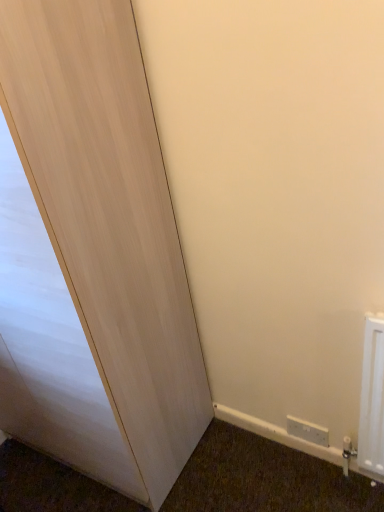
Describe the element at coordinates (308, 431) in the screenshot. I see `white plastic electric outlet at lower right` at that location.

At what (x,y) coordinates should I click in order to perform the action: click on white plastic electric outlet at lower right. Please return your answer as a coordinate pair (x, y). This screenshot has width=384, height=512. Looking at the image, I should click on (308, 431).

In order to face white plastic electric outlet at lower right, should I rotate leftwards or rightwards?

Rotate right and turn 15.168 degrees.

Measure the distance between white plastic electric outlet at lower right and camera.

The depth of white plastic electric outlet at lower right is 4.72 feet.

I want to click on light wood door at left, so click(x=91, y=255).

This screenshot has height=512, width=384. Describe the element at coordinates (91, 255) in the screenshot. I see `light wood door at left` at that location.

Where is `white plastic electric outlet at lower right`? white plastic electric outlet at lower right is located at coordinates (308, 431).

Which object is positioned more to the left, white plastic electric outlet at lower right or light wood door at left?

Positioned to the left is light wood door at left.

Which is in front, white plastic electric outlet at lower right or light wood door at left?

Positioned in front is light wood door at left.

Is point (326, 432) closer or farther from the camera than point (54, 250)?

Point (326, 432).

From the image's perspective, is white plastic electric outlet at lower right located above or below light wood door at left?

Based on their image positions, white plastic electric outlet at lower right is located beneath light wood door at left.

From a real-world perspective, who is located higher, white plastic electric outlet at lower right or light wood door at left?

In real-world perspective, light wood door at left is above.

Which object is thinner, white plastic electric outlet at lower right or light wood door at left?

With smaller width is white plastic electric outlet at lower right.

Who is taller, white plastic electric outlet at lower right or light wood door at left?

Standing taller between the two is light wood door at left.

Who is bigger, white plastic electric outlet at lower right or light wood door at left?

With larger size is light wood door at left.

Is white plastic electric outlet at lower right situated inside light wood door at left or outside?

white plastic electric outlet at lower right is not inside light wood door at left, it's outside.

Is white plastic electric outlet at lower right not close to light wood door at left?

No, white plastic electric outlet at lower right is not far away from light wood door at left.

From the picture: Could you tell me if white plastic electric outlet at lower right is turned towards light wood door at left?

No, white plastic electric outlet at lower right is not facing towards light wood door at left.

How many degrees apart are the facing directions of white plastic electric outlet at lower right and light wood door at left?

They differ by 1.87 degrees in their facing directions.

Identify the location of electric outlet on the right of light wood door at left. (308, 431).

Which is more to the left, light wood door at left or white plastic electric outlet at lower right?

Positioned to the left is light wood door at left.

Is light wood door at left further to the viewer compared to white plastic electric outlet at lower right?

No, light wood door at left is closer to the viewer.

In the scene shown: Which is closer, (x=158, y=284) or (x=302, y=435)?

Clearly, point (x=158, y=284) is closer to the camera than point (x=302, y=435).

From the image's perspective, would you say light wood door at left is positioned over white plastic electric outlet at lower right?

Yes, from the image's perspective, light wood door at left is above white plastic electric outlet at lower right.

From a real-world perspective, is light wood door at left under white plastic electric outlet at lower right?

No, from a real-world perspective, light wood door at left is not beneath white plastic electric outlet at lower right.

Between light wood door at left and white plastic electric outlet at lower right, which one has smaller width?

white plastic electric outlet at lower right.

In terms of height, does light wood door at left look taller or shorter compared to white plastic electric outlet at lower right?

In the image, light wood door at left appears to be taller than white plastic electric outlet at lower right.

Does light wood door at left have a larger size compared to white plastic electric outlet at lower right?

Yes, light wood door at left is bigger than white plastic electric outlet at lower right.

Consider the image. Would you say light wood door at left is outside white plastic electric outlet at lower right?

light wood door at left is positioned outside white plastic electric outlet at lower right.

Are light wood door at left and white plastic electric outlet at lower right beside each other?

They are not placed beside each other.

Could you tell me if light wood door at left is turned towards white plastic electric outlet at lower right?

No, light wood door at left is not turned towards white plastic electric outlet at lower right.

Locate an element on the screen. This screenshot has height=512, width=384. door above the white plastic electric outlet at lower right (from the image's perspective) is located at coordinates (91, 255).

The height and width of the screenshot is (512, 384). In order to click on electric outlet on the right of light wood door at left in this screenshot , I will do coord(308,431).

This screenshot has width=384, height=512. I want to click on door on the left of white plastic electric outlet at lower right, so click(91, 255).